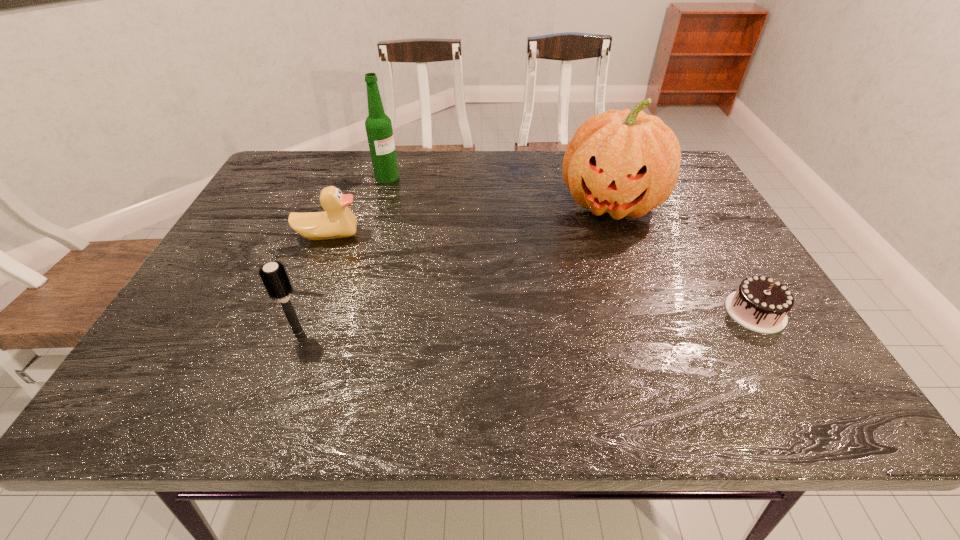
Locate an element on the screen. The width and height of the screenshot is (960, 540). chocolate cake situated at the near edge is located at coordinates (761, 304).

Where is `chocolate cake at the right edge`? The height and width of the screenshot is (540, 960). chocolate cake at the right edge is located at coordinates (761, 304).

This screenshot has height=540, width=960. What are the coordinates of `pumpkin at the right edge` in the screenshot? It's located at (626, 163).

This screenshot has width=960, height=540. Find the location of `object located at the far right corner`. object located at the far right corner is located at coordinates (626, 163).

Where is `object that is positioned at the near right corner`? This screenshot has height=540, width=960. object that is positioned at the near right corner is located at coordinates (761, 304).

This screenshot has width=960, height=540. Find the location of `vacant space at the far edge of the desktop`. vacant space at the far edge of the desktop is located at coordinates (371, 179).

Locate an element on the screen. vacant region at the near edge of the desktop is located at coordinates (654, 356).

The height and width of the screenshot is (540, 960). Identify the location of free location at the left edge. (258, 203).

Where is `blank space at the right edge of the desktop`? The height and width of the screenshot is (540, 960). blank space at the right edge of the desktop is located at coordinates (708, 250).

Locate an element on the screen. The width and height of the screenshot is (960, 540). vacant area that lies between the fourth object from left to right and the beer bottle is located at coordinates (499, 190).